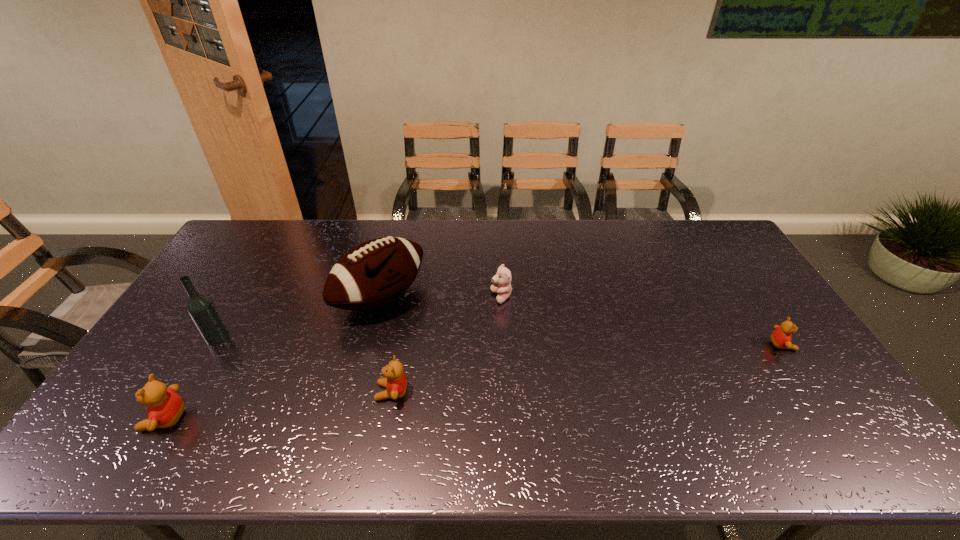
Where is `vacant space situated on the front-facing side of the third teddy bear from right to left`? vacant space situated on the front-facing side of the third teddy bear from right to left is located at coordinates (250, 392).

You are a GUI agent. You are given a task and a screenshot of the screen. Output one action in this format:
    pyautogui.click(x=<x>, y=<y>)
    Task: Click on the vacant space located 0.210m on the front-facing side of the third teddy bear from right to left
    
    Given the screenshot: What is the action you would take?
    pyautogui.click(x=296, y=392)

Image resolution: width=960 pixels, height=540 pixels. I want to click on vacant space located 0.090m at the face of the second object from right to left, so click(x=463, y=297).

Locate an element on the screen. vacant space located 0.200m at the face of the second object from right to left is located at coordinates (428, 297).

This screenshot has height=540, width=960. Find the location of `vacant space situated at the face of the second object from right to left`. vacant space situated at the face of the second object from right to left is located at coordinates (441, 297).

Identify the location of vacant space located 0.270m on the back of the vodka. (257, 272).

Where is `vacant space located 0.300m on the back of the football (American)`? The height and width of the screenshot is (540, 960). vacant space located 0.300m on the back of the football (American) is located at coordinates (399, 222).

Where is `teddy bear that is at the left edge`? The height and width of the screenshot is (540, 960). teddy bear that is at the left edge is located at coordinates (164, 407).

Locate an element on the screen. vodka at the left edge is located at coordinates (200, 308).

Find the location of `object that is at the right edge`. object that is at the right edge is located at coordinates (781, 338).